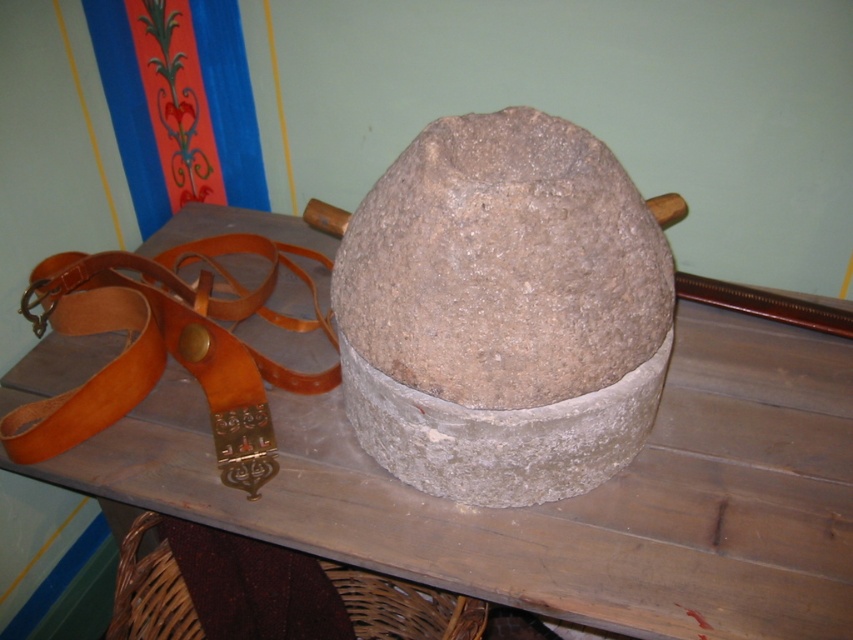
Question: Which of the following is the closest to the observer?

Choices:
 (A) (76, 420)
 (B) (828, 536)
 (C) (370, 296)

Answer: (C)

Question: Is smooth wooden table at center to the right of gray rough stone at center from the viewer's perspective?

Choices:
 (A) yes
 (B) no

Answer: (B)

Question: Which object is the closest to the brown leather belt at left?

Choices:
 (A) gray rough stone at center
 (B) smooth wooden table at center

Answer: (B)

Question: Which of the following is the closest to the observer?

Choices:
 (A) smooth wooden table at center
 (B) gray rough stone at center
 (C) brown leather belt at left

Answer: (B)

Question: Is gray rough stone at center above brown leather belt at left?

Choices:
 (A) no
 (B) yes

Answer: (B)

Question: Can you confirm if smooth wooden table at center is wider than gray rough stone at center?

Choices:
 (A) yes
 (B) no

Answer: (A)